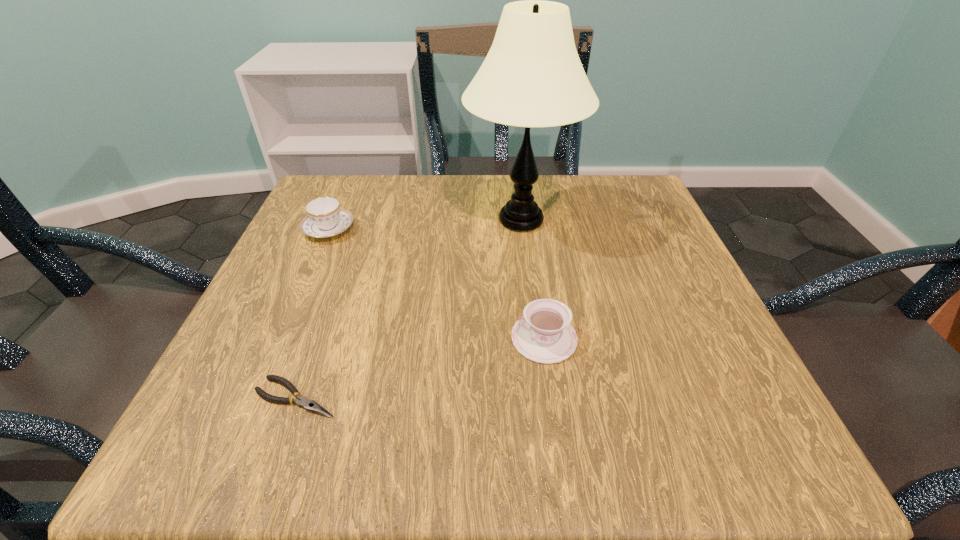
Locate an element on the screen. vacant space at the near edge of the desktop is located at coordinates (534, 407).

In the image, there is a desktop. At what (x,y) coordinates should I click in order to perform the action: click on vacant space at the left edge. Please return your answer as a coordinate pair (x, y). The image size is (960, 540). Looking at the image, I should click on (224, 365).

In the image, there is a desktop. Where is `blank space at the right edge`? The image size is (960, 540). blank space at the right edge is located at coordinates (726, 372).

Locate an element on the screen. This screenshot has height=540, width=960. vacant space at the far left corner of the desktop is located at coordinates (351, 201).

Image resolution: width=960 pixels, height=540 pixels. In the image, there is a desktop. What are the coordinates of `vacant space at the near left corner` in the screenshot? It's located at (219, 412).

What are the coordinates of `free space at the far right corner of the desktop` in the screenshot? It's located at (667, 232).

Identify the location of vacant space at the near right corner. (672, 414).

This screenshot has height=540, width=960. I want to click on vacant point located between the second nearest object and the left teacup, so click(x=436, y=284).

Locate an element on the screen. This screenshot has height=540, width=960. vacant point located between the right teacup and the tallest object is located at coordinates (533, 279).

Where is `vacant point located between the second nearest object and the shortest object`? vacant point located between the second nearest object and the shortest object is located at coordinates (420, 368).